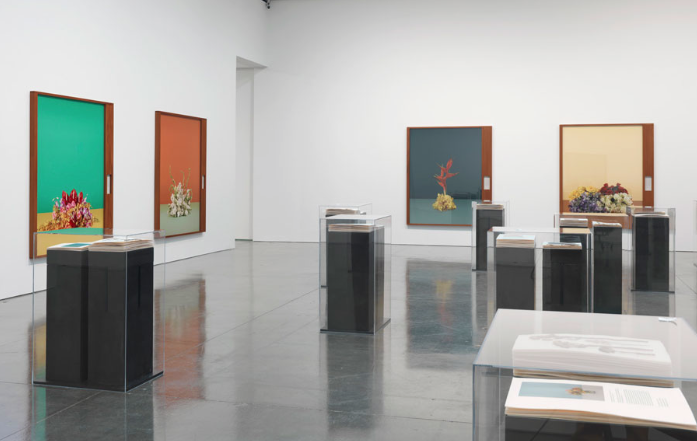
The image size is (697, 441). Identify the location of floor. (97, 325).